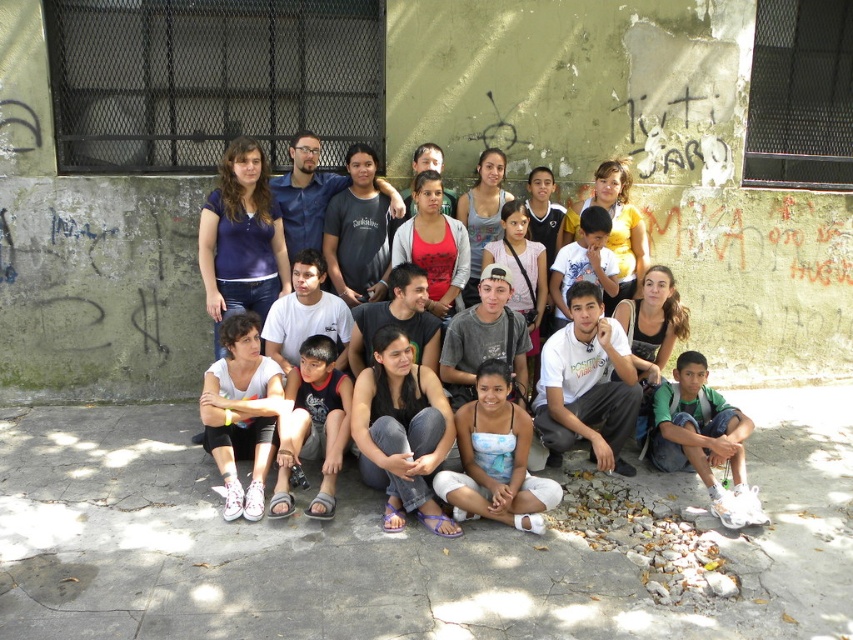
You are a photographer adjusting the camera settings to ensure all clothing items are in focus. The jeans at center and the white fabric shirt at lower left are both in your frame. Which clothing item requires you to adjust the focus to a closer distance?

The jeans at center requires adjusting the focus to a closer distance because it is shorter than the white fabric shirt at lower left, meaning it is physically closer to the camera.

Looking at this image, you are a photographer trying to adjust the focus on your camera. You notice two items at the center of the image, the jeans at center and the blue printed tank top at center. Which item should you focus on if you want to ensure the taller object is in sharp focus?

The jeans at center is taller than the blue printed tank top at center, so you should focus on the jeans at center to ensure the taller object is in sharp focus.